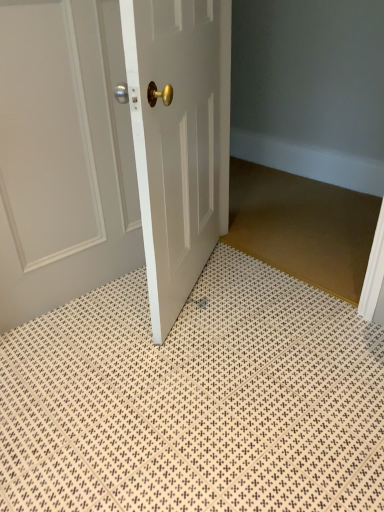
Question: Considering their positions, is white glossy door at upper left, which ranks as the second door in right-to-left order, located in front of or behind brown textured mat at center?

Choices:
 (A) behind
 (B) front

Answer: (B)

Question: Considering the positions of point pyautogui.click(x=56, y=267) and point pyautogui.click(x=235, y=194), is point pyautogui.click(x=56, y=267) closer or farther from the camera than point pyautogui.click(x=235, y=194)?

Choices:
 (A) farther
 (B) closer

Answer: (B)

Question: Which is nearer to the white glossy door at upper left, which ranks as the second door in right-to-left order?

Choices:
 (A) white glossy door at center, the 2th door in the left-to-right sequence
 (B) brown textured mat at center
 (C) white textured bath mat at center

Answer: (A)

Question: Which object is the closest to the brown textured mat at center?

Choices:
 (A) white glossy door at center, which is the first door in right-to-left order
 (B) white glossy door at upper left, which ranks as the second door in right-to-left order
 (C) white textured bath mat at center

Answer: (A)